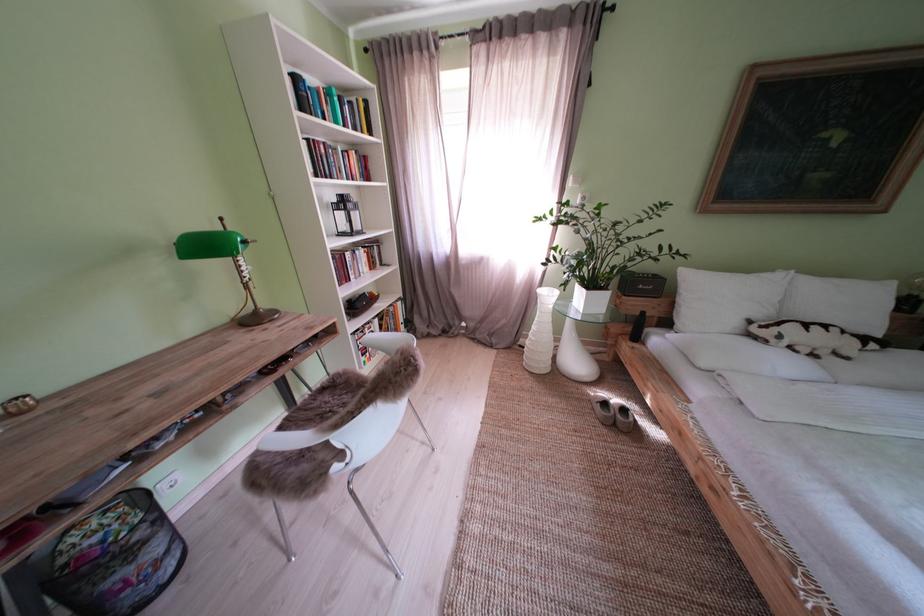
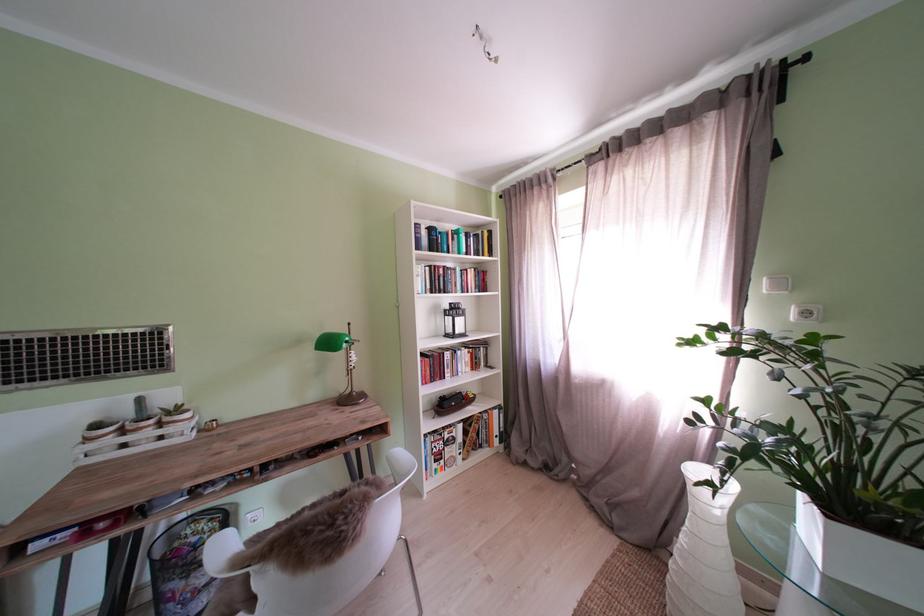
Where in the second image is the point corresponding to the point at 594,204 from the first image?

(818, 318)